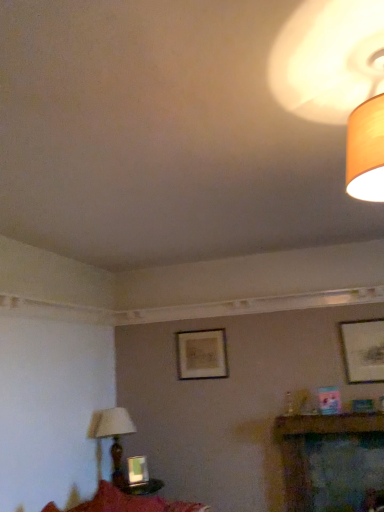
Question: Is the position of matte wooden picture frame at center, the second picture frame positioned from the bottom, more distant than that of matte black picture frame at upper right, the 3th picture frame in the back-to-front sequence?

Choices:
 (A) no
 (B) yes

Answer: (B)

Question: Is matte wooden picture frame at center, which is the second picture frame in left-to-right order, not near matte black picture frame at upper right, which ranks as the 3th picture frame in bottom-to-top order?

Choices:
 (A) no
 (B) yes

Answer: (B)

Question: Considering the relative sizes of matte wooden picture frame at center, which is the second picture frame in left-to-right order, and matte black picture frame at upper right, the first picture frame when ordered from top to bottom, in the image provided, is matte wooden picture frame at center, which is the second picture frame in left-to-right order, wider than matte black picture frame at upper right, the first picture frame when ordered from top to bottom,?

Choices:
 (A) yes
 (B) no

Answer: (B)

Question: Is matte wooden picture frame at center, arranged as the 2th picture frame when viewed from the top, next to matte black picture frame at upper right, marked as the 3th picture frame in a left-to-right arrangement, and touching it?

Choices:
 (A) no
 (B) yes

Answer: (A)

Question: Is matte wooden picture frame at center, the second picture frame positioned from the bottom, completely or partially outside of matte black picture frame at upper right, the 3th picture frame in the back-to-front sequence?

Choices:
 (A) yes
 (B) no

Answer: (A)

Question: Considering the positions of matte wooden picture frame at center, which ranks as the third picture frame in front-to-back order, and wooden lampshade at lower left, which appears as the first lamp when viewed from the back, in the image, is matte wooden picture frame at center, which ranks as the third picture frame in front-to-back order, taller or shorter than wooden lampshade at lower left, which appears as the first lamp when viewed from the back,?

Choices:
 (A) tall
 (B) short

Answer: (B)

Question: In terms of size, does matte wooden picture frame at center, the 1th picture frame in the back-to-front sequence, appear bigger or smaller than wooden lampshade at lower left, the second lamp positioned from the top?

Choices:
 (A) big
 (B) small

Answer: (B)

Question: From a real-world perspective, is matte wooden picture frame at center, positioned as the 2th picture frame in right-to-left order, positioned above or below wooden lampshade at lower left, which ranks as the 1th lamp in left-to-right order?

Choices:
 (A) below
 (B) above

Answer: (B)

Question: Considering the positions of matte wooden picture frame at center, which is the second picture frame in left-to-right order, and wooden lampshade at lower left, which is counted as the second lamp, starting from the right, in the image, is matte wooden picture frame at center, which is the second picture frame in left-to-right order, wider or thinner than wooden lampshade at lower left, which is counted as the second lamp, starting from the right,?

Choices:
 (A) thin
 (B) wide

Answer: (A)

Question: Would you say matte black picture frame at upper right, marked as the 3th picture frame in a left-to-right arrangement, is inside or outside metallic silver picture frame at lower center, which is the second picture frame from front to back?

Choices:
 (A) inside
 (B) outside

Answer: (B)

Question: Considering the positions of point (380, 340) and point (137, 461), is point (380, 340) closer or farther from the camera than point (137, 461)?

Choices:
 (A) closer
 (B) farther

Answer: (A)

Question: Is matte black picture frame at upper right, which ranks as the 3th picture frame in bottom-to-top order, wider or thinner than metallic silver picture frame at lower center, which ranks as the first picture frame in left-to-right order?

Choices:
 (A) wide
 (B) thin

Answer: (B)

Question: Considering their positions, is matte black picture frame at upper right, which is counted as the 1th picture frame, starting from the front, located in front of or behind metallic silver picture frame at lower center, which is counted as the 1th picture frame, starting from the bottom?

Choices:
 (A) behind
 (B) front

Answer: (B)

Question: Is point (99, 477) closer or farther from the camera than point (382, 332)?

Choices:
 (A) farther
 (B) closer

Answer: (A)

Question: Visually, is wooden lampshade at lower left, which ranks as the 1th lamp in left-to-right order, positioned to the left or to the right of matte black picture frame at upper right, the first picture frame when ordered from top to bottom?

Choices:
 (A) right
 (B) left

Answer: (B)